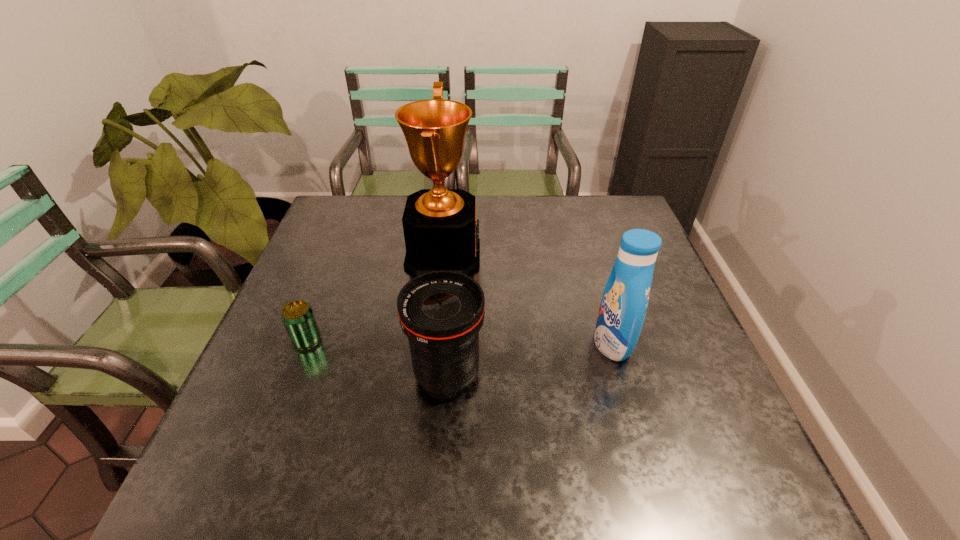
Locate an element on the screen. The width and height of the screenshot is (960, 540). vacant region located 0.330m on the front-facing side of the third shortest object is located at coordinates (452, 342).

The height and width of the screenshot is (540, 960). In order to click on vacant space situated 0.170m on the right of the second shortest object in this screenshot , I will do `click(564, 374)`.

The width and height of the screenshot is (960, 540). What are the coordinates of `free space located 0.340m on the right of the beer can` in the screenshot? It's located at (468, 340).

Locate an element on the screen. The height and width of the screenshot is (540, 960). object that is at the far edge is located at coordinates (439, 224).

Identify the location of object present at the left edge. (298, 318).

Where is `object present at the right edge`? object present at the right edge is located at coordinates (623, 307).

In the image, there is a desktop. Where is `free space at the far edge`? This screenshot has width=960, height=540. free space at the far edge is located at coordinates (557, 221).

The image size is (960, 540). I want to click on vacant region at the near edge of the desktop, so click(x=293, y=496).

Image resolution: width=960 pixels, height=540 pixels. In the image, there is a desktop. In order to click on vacant space at the left edge in this screenshot , I will do `click(296, 300)`.

Locate an element on the screen. This screenshot has height=540, width=960. free location at the right edge of the desktop is located at coordinates (611, 245).